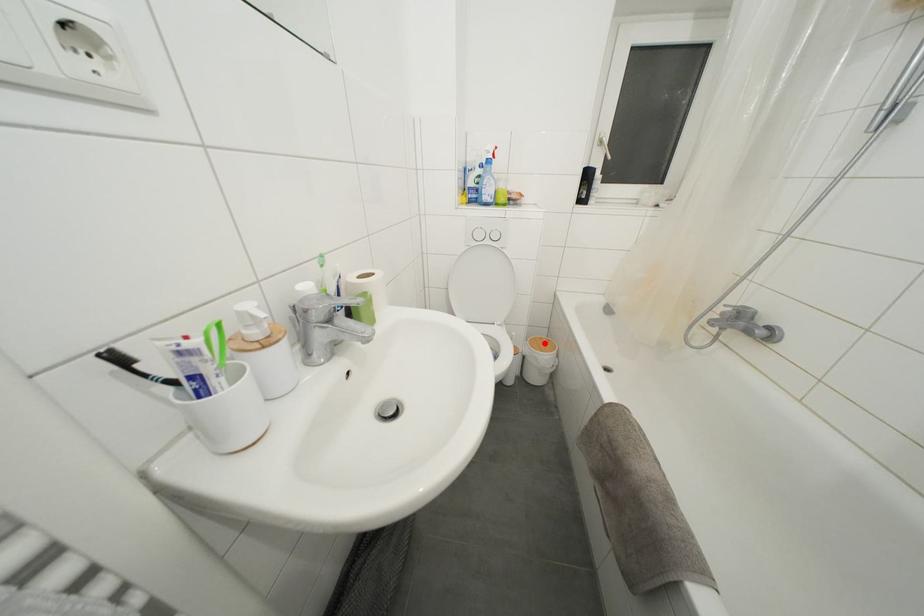
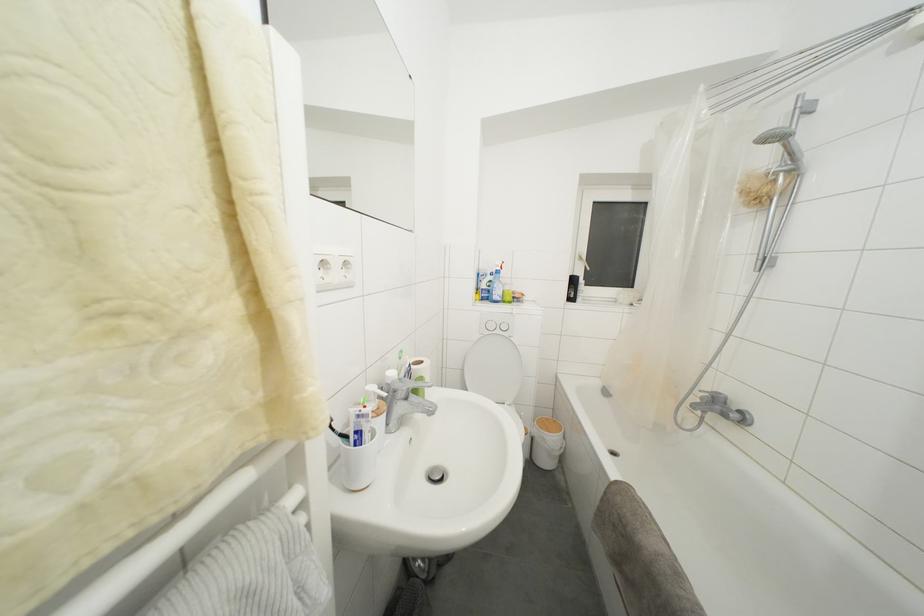
Question: I am providing you with two images of the same scene from different viewpoints. In image1, a red point is highlighted. Considering the same 3D point in image2, which of the following is correct?

Choices:
 (A) It is closer
 (B) It is farther

Answer: (B)